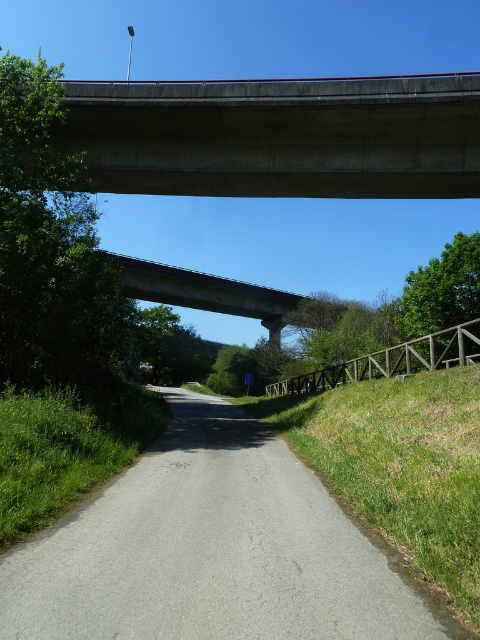
Between point (358, 532) and point (472, 493), which one is positioned in front?

Point (472, 493) is in front.

Between point (104, 538) and point (431, 550), which one is positioned behind?

The point (104, 538) is more distant.

The width and height of the screenshot is (480, 640). Describe the element at coordinates (210, 548) in the screenshot. I see `gray asphalt road at center` at that location.

What are the coordinates of `gray asphalt road at center` in the screenshot? It's located at (210, 548).

Which is below, gray asphalt road at center or concrete at upper center?

gray asphalt road at center is lower down.

Find the location of a particular element. This screenshot has width=480, height=640. gray asphalt road at center is located at coordinates (210, 548).

Locate an element on the screen. gray asphalt road at center is located at coordinates (210, 548).

Looking at this image, does concrete at upper center appear on the right side of concrete bridge at center?

Correct, you'll find concrete at upper center to the right of concrete bridge at center.

Between point (457, 145) and point (272, 328), which one is positioned in front?

Point (457, 145) is more forward.

Identify the location of concrete at upper center. The height and width of the screenshot is (640, 480). (279, 136).